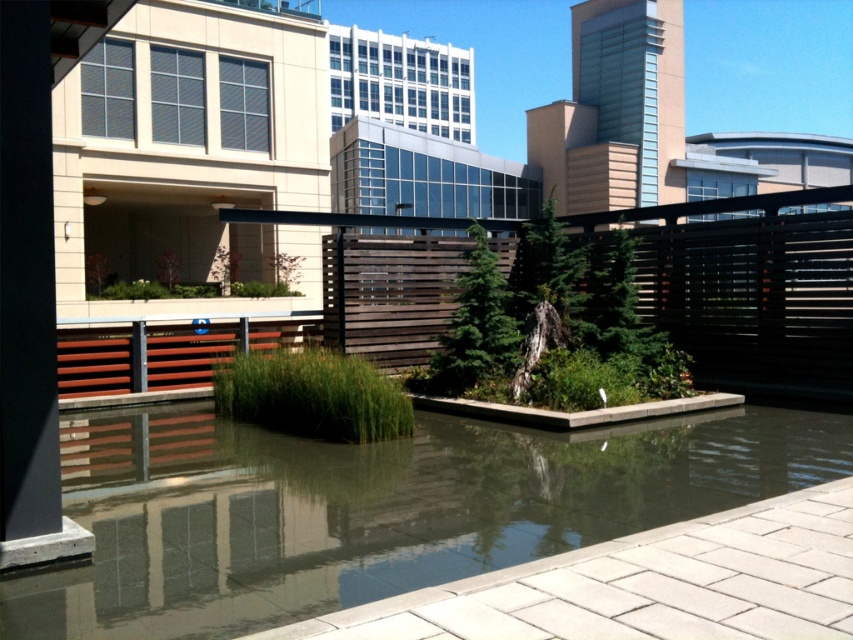
In the scene shown: You are standing on the rooftop garden and want to walk from the dark brown wooden fence at center to the clear glass water at center. Which direction should you move?

You should move to the right to reach the clear glass water at center from the dark brown wooden fence at center because the clear glass water at center is located to the right of the dark brown wooden fence at center.

You are designing a layout for a rooftop garden and need to place a small bench. The bench requires a space larger than the clear glass water at center. Can you place it near the dark brown wooden fence at center?

The clear glass water at center has a smaller size compared to the dark brown wooden fence at center. Since the bench requires a space larger than the clear glass water at center, you can place it near the dark brown wooden fence at center as it is larger and provides sufficient space.

You are a gardener working on the rooftop garden. You need to place a new potted plant between the clear glass water at center and the dark brown wooden fence at center. Which object should the potted plant be closer to if you want it to be visible from above without obstruction?

The potted plant should be closer to the clear glass water at center because it is shorter than the dark brown wooden fence at center, so placing it near the shorter object would allow better visibility from above.